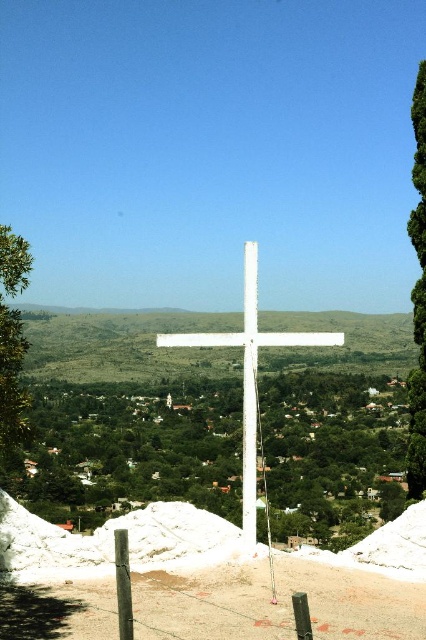
Between point (218, 458) and point (420, 355), which one is positioned in front?

Positioned in front is point (420, 355).

Can you confirm if green leafy tree at center is positioned to the right of green leafy tree at right?

In fact, green leafy tree at center is to the left of green leafy tree at right.

You are a GUI agent. You are given a task and a screenshot of the screen. Output one action in this format:
    pyautogui.click(x=<x>, y=<y>)
    Task: Click on the green leafy tree at center
    This screenshot has width=426, height=640.
    Given the screenshot: What is the action you would take?
    point(131,451)

Looking at this image, who is higher up, green leafy tree at right or green leafy tree at left?

green leafy tree at right

Can you confirm if green leafy tree at right is taller than green leafy tree at left?

Yes, green leafy tree at right is taller than green leafy tree at left.

What do you see at coordinates (417, 298) in the screenshot? I see `green leafy tree at right` at bounding box center [417, 298].

The height and width of the screenshot is (640, 426). Identify the location of green leafy tree at right. (417, 298).

Can you confirm if green leafy tree at center is taller than white matte cross at center?

Incorrect, green leafy tree at center's height is not larger of white matte cross at center's.

How distant is green leafy tree at center from white matte cross at center?

green leafy tree at center and white matte cross at center are 19.48 meters apart.

Is point (377, 380) positioned in front of point (256, 406)?

No, (377, 380) is behind (256, 406).

The image size is (426, 640). Find the location of `green leafy tree at center`. green leafy tree at center is located at coordinates (131, 451).